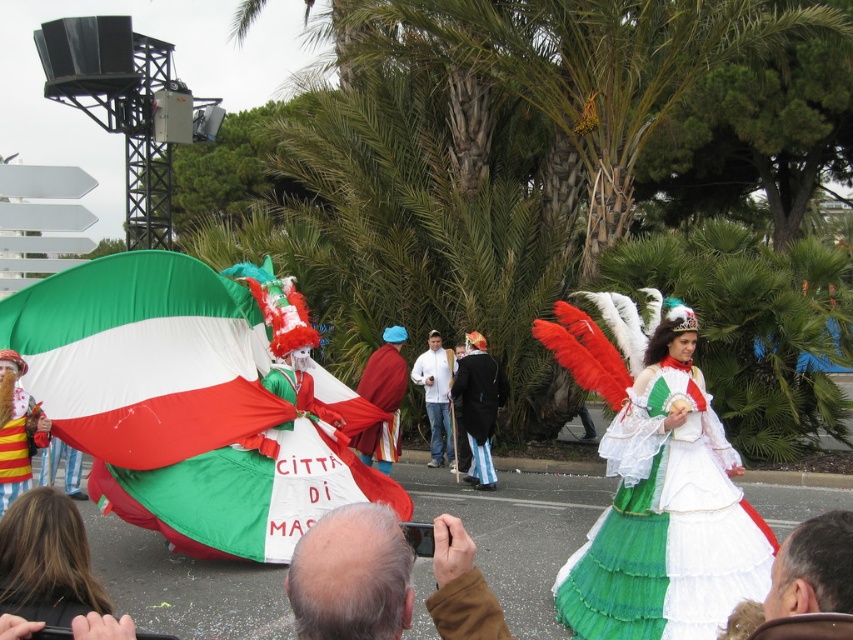
You are a photographer at the parade. You need to capture a photo that includes both the matte fabric flag at left and the velvet maroon cape at center. Which object should you position closer to the edge of the frame to ensure both fit in the shot?

The matte fabric flag at left is wider than the velvet maroon cape at center. To ensure both fit in the shot, position the wider matte fabric flag at left closer to the edge of the frame so that its greater width doesn

You are a photographer at the event and want to capture both the matte fabric flag at left and the velvet maroon cape at center in a single shot. Which object should you focus on first to ensure both are in frame?

The matte fabric flag at left is taller than the velvet maroon cape at center, so focusing on the taller flag first will help frame both objects effectively.

You are a photographer standing at the camera position. You want to capture a closeup of the gray hair at upper center. The camera has a minimum focusing distance of 5 feet. Can you take the photo without moving closer?

The gray hair at upper center is 7.74 feet from the camera, which is beyond the minimum focusing distance of 5 feet. Therefore, you can take the photo without moving closer.